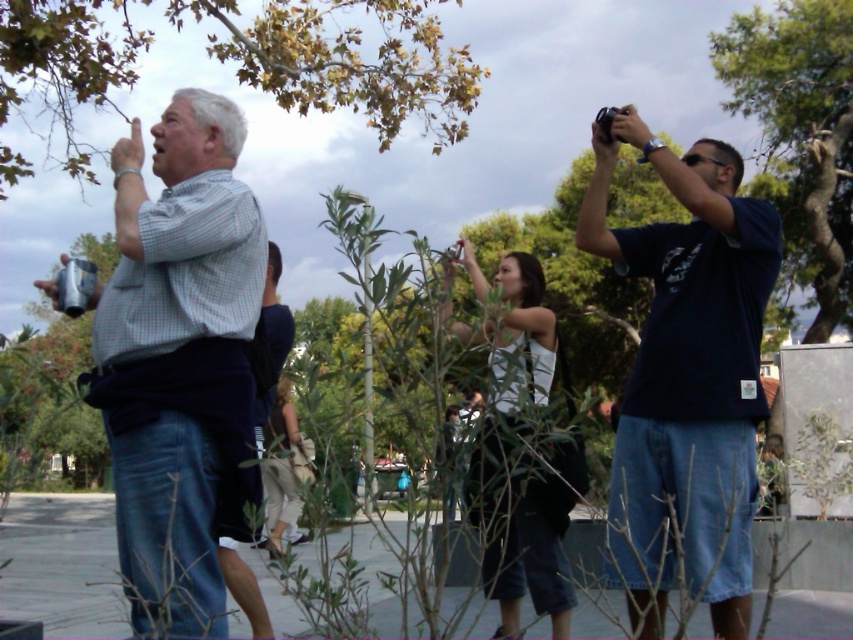
Can you confirm if dark blue t-shirt at upper right is positioned to the right of green leafy tree at upper left?

Indeed, dark blue t-shirt at upper right is positioned on the right side of green leafy tree at upper left.

The height and width of the screenshot is (640, 853). What do you see at coordinates (688, 376) in the screenshot?
I see `dark blue t-shirt at upper right` at bounding box center [688, 376].

Based on the photo, who is more forward, [614,557] or [292,3]?

Point [614,557]

Image resolution: width=853 pixels, height=640 pixels. I want to click on dark blue t-shirt at upper right, so click(688, 376).

Consider the image. Can you confirm if dark blue t-shirt at upper right is positioned to the left of khaki fabric pants at center?

No, dark blue t-shirt at upper right is not to the left of khaki fabric pants at center.

Can you confirm if dark blue t-shirt at upper right is smaller than khaki fabric pants at center?

No, dark blue t-shirt at upper right is not smaller than khaki fabric pants at center.

Find the location of a particular element. dark blue t-shirt at upper right is located at coordinates (688, 376).

The width and height of the screenshot is (853, 640). Identify the location of dark blue t-shirt at upper right. (688, 376).

Does checkered fabric shirt at left have a lesser height compared to white matte tank top at center?

Yes, checkered fabric shirt at left is shorter than white matte tank top at center.

Can you confirm if checkered fabric shirt at left is thinner than white matte tank top at center?

In fact, checkered fabric shirt at left might be wider than white matte tank top at center.

Which is behind, point (258, 308) or point (494, 417)?

The point (258, 308) is behind.

The image size is (853, 640). What are the coordinates of `checkered fabric shirt at left` in the screenshot? It's located at pos(178,352).